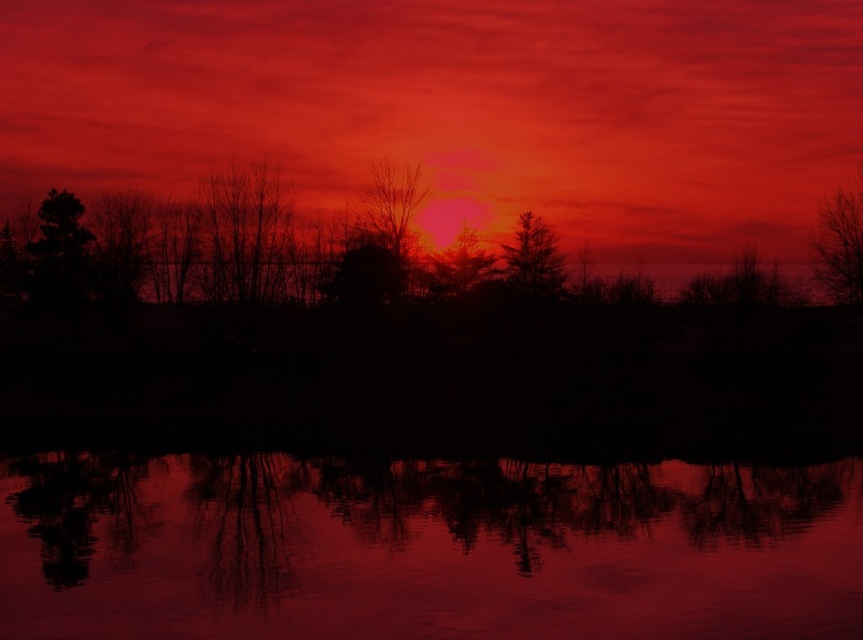
From the picture: You are a photographer standing on the lakeshore. You want to capture a photo that includes both the matte red sky at center and the silhouette bare tree at right. Given that your camera can focus on objects within a 30 meter range, will you be able to include both in the same frame without moving your position?

The matte red sky at center and silhouette bare tree at right are 32.03 meters apart from each other. Since the distance between them exceeds the camera focus range of 30 meters, you might not be able to capture both in sharp focus in the same frame without adjusting your position or settings.

Based on the photo, you are an artist trying to paint the sunset scene. You notice the matte red sky at center and the glossy water at center. Which object in the scene has a wider horizontal span?

The matte red sky at center has a wider horizontal span than the glossy water at center, as its width surpasses that of the glossy water at center.

You are an artist planning to paint the sunset scene. You notice the matte red sky at center and the glossy water at center. Which object in the scene is taller?

The matte red sky at center is much taller than the glossy water at center.